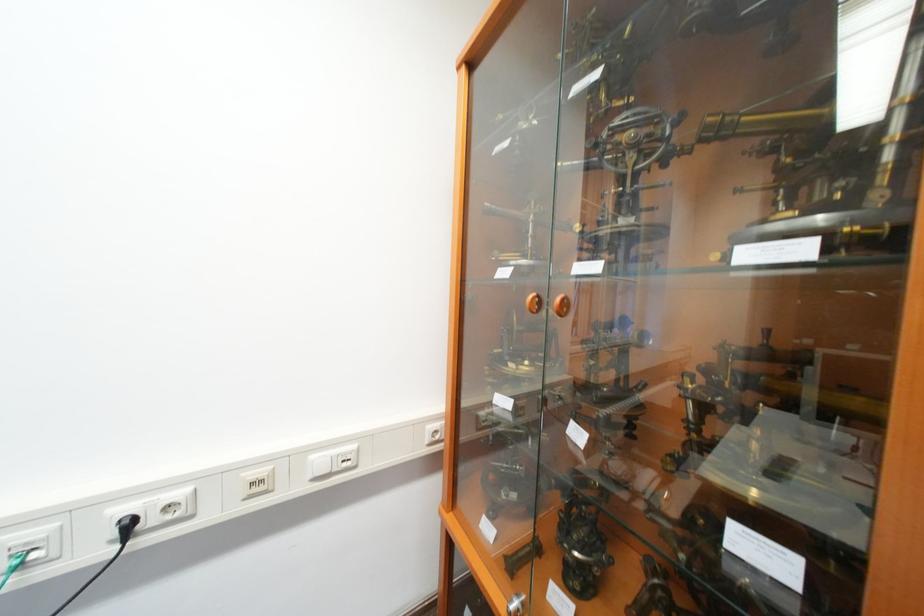
In order to click on shiny metal knob in this screenshot , I will do `click(516, 604)`.